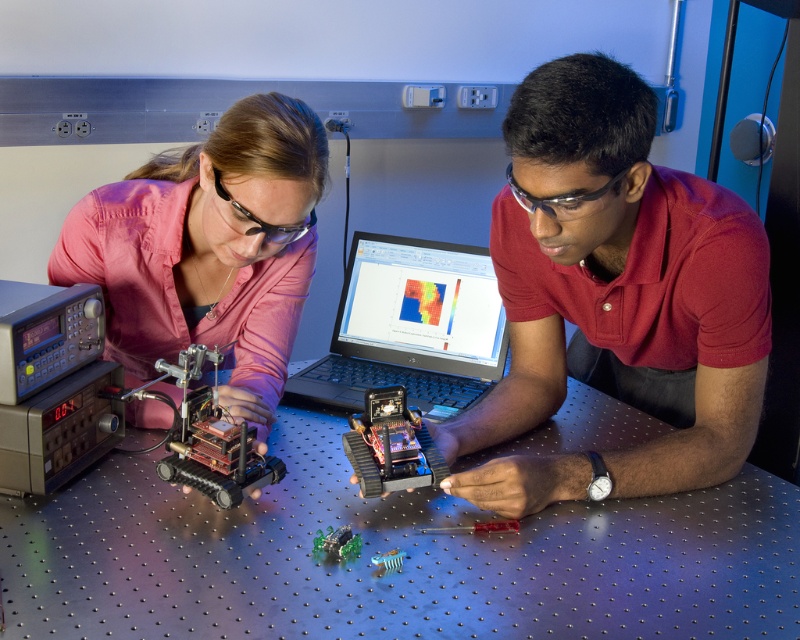
Question: Does gray metallic electronic device at left appear on the left side of shiny metallic circuit board at center?

Choices:
 (A) yes
 (B) no

Answer: (A)

Question: Which point is farther to the camera?

Choices:
 (A) (202, 308)
 (B) (380, 413)
 (C) (728, 282)
 (D) (462, 321)

Answer: (D)

Question: Based on their relative distances, which object is farther from the silver metallic laptop at center?

Choices:
 (A) gray metallic electronic device at left
 (B) red matte shirt at center

Answer: (A)

Question: Does red matte shirt at center appear over gray metallic electronic device at left?

Choices:
 (A) yes
 (B) no

Answer: (A)

Question: In this image, where is red matte shirt at center located relative to matte pink shirt at upper left?

Choices:
 (A) above
 (B) below

Answer: (B)

Question: Which object is farther from the camera taking this photo?

Choices:
 (A) metallic circuit board at left
 (B) gray metallic electronic device at left

Answer: (A)